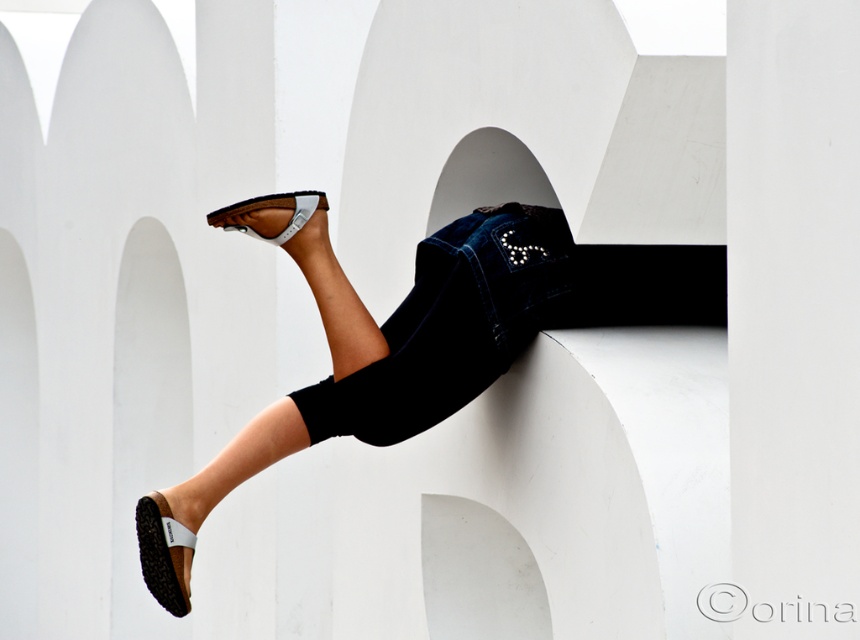
How distant is brown leather sandals at lower left from black rubber sandal at lower left?

A distance of 38.53 inches exists between brown leather sandals at lower left and black rubber sandal at lower left.

Does brown leather sandals at lower left have a smaller size compared to black rubber sandal at lower left?

No.

Is point (419, 300) less distant than point (169, 609)?

No, it is behind (169, 609).

The height and width of the screenshot is (640, 860). In order to click on brown leather sandals at lower left in this screenshot , I will do `click(406, 340)`.

Does point (404, 298) come closer to viewer compared to point (272, 205)?

No.

Where is `denim jacket at center`? denim jacket at center is located at coordinates (453, 324).

Is brown leather sandals at lower left wider than brown leather sandal at upper center?

Correct, the width of brown leather sandals at lower left exceeds that of brown leather sandal at upper center.

Between brown leather sandals at lower left and brown leather sandal at upper center, which one is positioned lower?

Positioned lower is brown leather sandals at lower left.

Is point (330, 305) positioned after point (234, 204)?

Yes, point (330, 305) is behind point (234, 204).

Image resolution: width=860 pixels, height=640 pixels. I want to click on brown leather sandals at lower left, so click(x=406, y=340).